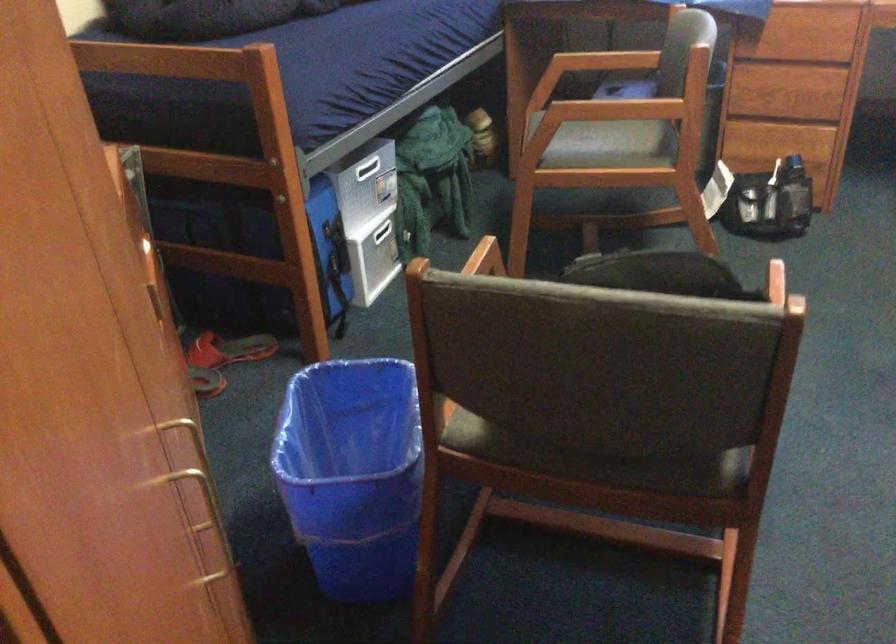
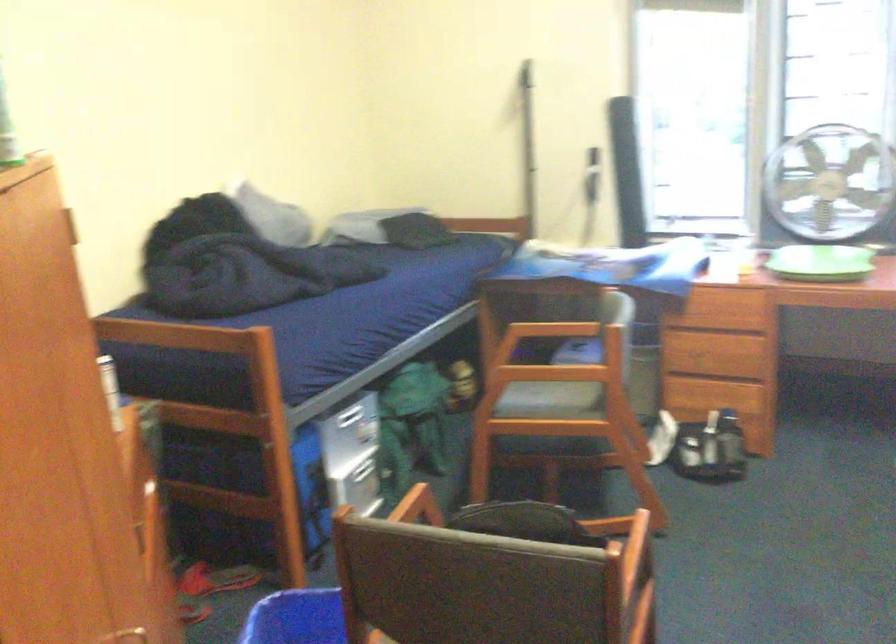
Find the pixel in the second image that matches the point at 668,275 in the first image.

(528, 523)